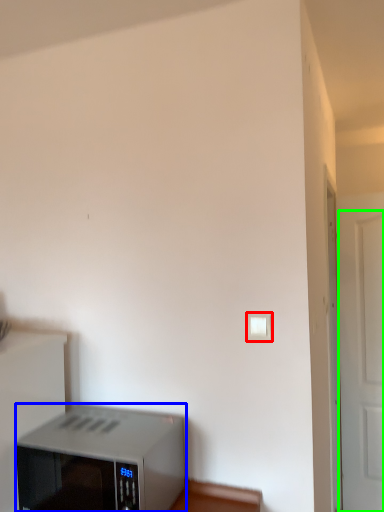
Question: Which object is positioned closest to light switch (highlighted by a red box)? Select from home appliance (highlighted by a blue box) and door (highlighted by a green box).

Choices:
 (A) home appliance
 (B) door

Answer: (A)